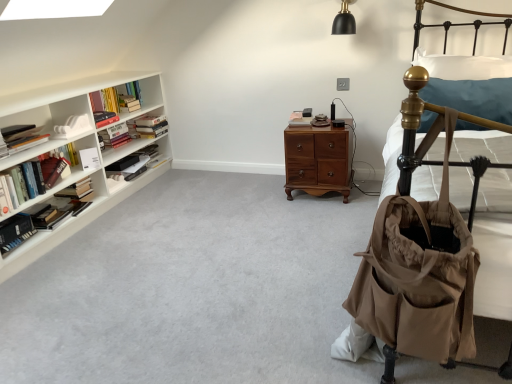
The height and width of the screenshot is (384, 512). In order to click on empty space that is ontop of brown wood nightstand at center in this screenshot , I will do `click(314, 118)`.